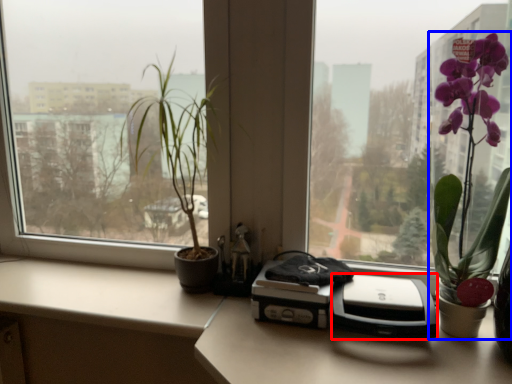
Question: Which of the following is the closest to the observer, printer (highlighted by a red box) or houseplant (highlighted by a blue box)?

Choices:
 (A) printer
 (B) houseplant

Answer: (B)